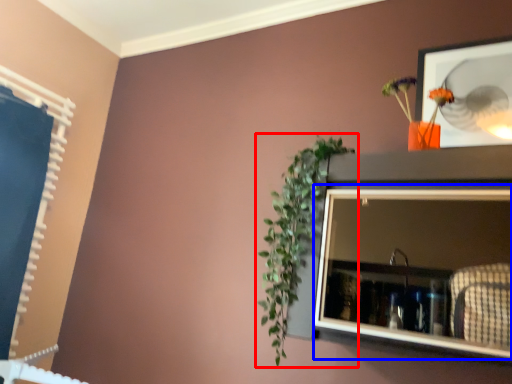
Question: Which point is further to the camera, houseplant (highlighted by a red box) or medicine cabinet (highlighted by a blue box)?

Choices:
 (A) houseplant
 (B) medicine cabinet

Answer: (A)